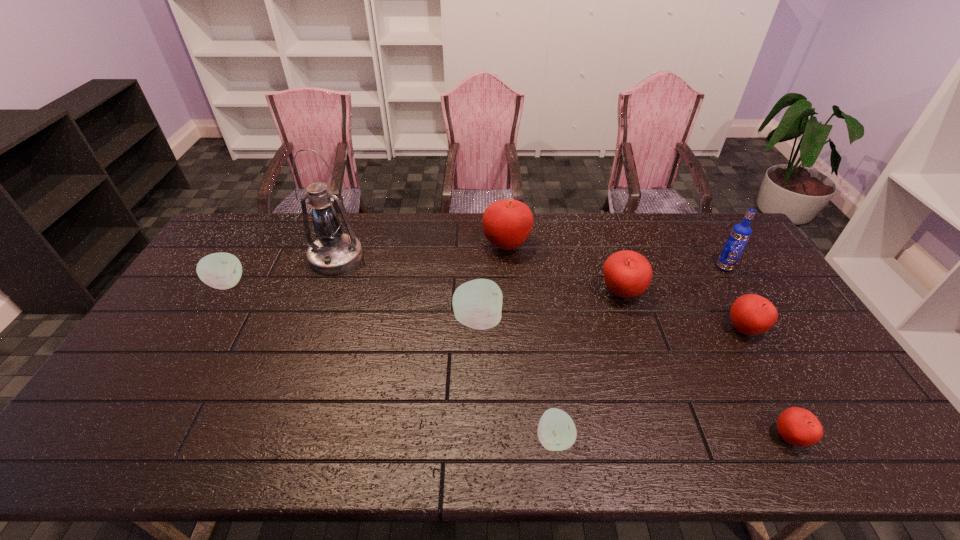
Locate an element on the screen. the second object from left to right is located at coordinates (334, 252).

Image resolution: width=960 pixels, height=540 pixels. In order to click on oil lamp in this screenshot , I will do `click(334, 252)`.

Where is `blue vodka`? The image size is (960, 540). blue vodka is located at coordinates (741, 232).

The height and width of the screenshot is (540, 960). Find the location of `the second tallest object`. the second tallest object is located at coordinates (741, 232).

Where is `the biggest red apple`? This screenshot has height=540, width=960. the biggest red apple is located at coordinates (507, 223).

Where is `the farthest apple`? The height and width of the screenshot is (540, 960). the farthest apple is located at coordinates (507, 223).

Where is `the second nearest white apple`? the second nearest white apple is located at coordinates (477, 304).

Image resolution: width=960 pixels, height=540 pixels. Identify the location of the biggest white apple. (477, 304).

The height and width of the screenshot is (540, 960). Find the location of `the third apple from right to left`. the third apple from right to left is located at coordinates (627, 274).

Find the location of a particular element. The width and height of the screenshot is (960, 540). the third nearest red apple is located at coordinates (627, 274).